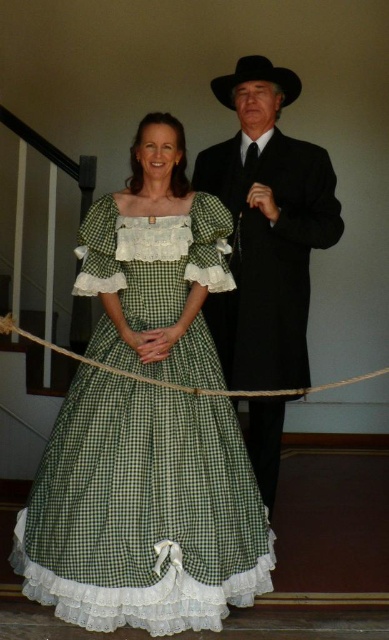
Measure the distance between point (171, 428) and camera.

Point (171, 428) and camera are 11.40 feet apart from each other.

Can you confirm if green checkered dress at center is shorter than black felt cowboy hat at upper center?

No.

Locate an element on the screen. Image resolution: width=389 pixels, height=640 pixels. green checkered dress at center is located at coordinates (143, 512).

Is green checkered dress at center thinner than matte black suit at center?

No, green checkered dress at center is not thinner than matte black suit at center.

Can you confirm if green checkered dress at center is shorter than matte black suit at center?

Yes.

The image size is (389, 640). I want to click on green checkered dress at center, so click(143, 512).

Between matte black suit at center and black felt cowboy hat at upper center, which one has more height?

With more height is matte black suit at center.

Can you confirm if matte black suit at center is positioned below black felt cowboy hat at upper center?

Yes, matte black suit at center is below black felt cowboy hat at upper center.

What do you see at coordinates (266, 228) in the screenshot? Image resolution: width=389 pixels, height=640 pixels. I see `matte black suit at center` at bounding box center [266, 228].

This screenshot has height=640, width=389. I want to click on matte black suit at center, so click(266, 228).